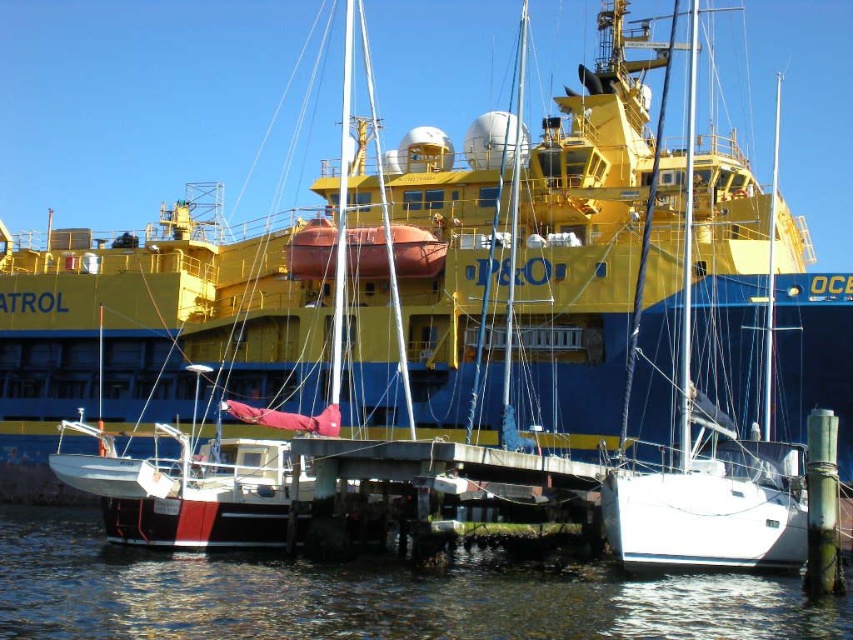
You are a photographer planning to capture the white matte sailboat at center and the clear water at lower center in a single frame. Which object will occupy more horizontal space in your photo?

The clear water at lower center will occupy more horizontal space in the photo because its width surpasses that of the white matte sailboat at center.

You are standing on the pier and looking at the clear water at lower center and the white matte sailboat at center. Which object is located directly above the other?

The white matte sailboat at center is positioned above the clear water at lower center.